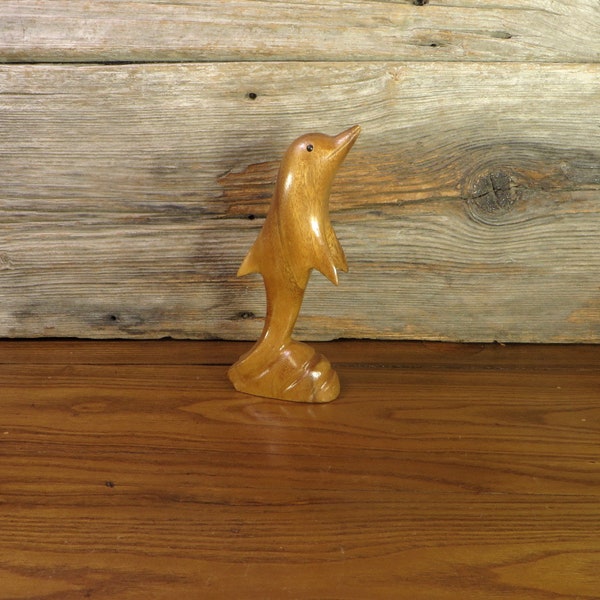
You are a GUI agent. You are given a task and a screenshot of the screen. Output one action in this format:
    pyautogui.click(x=<x>, y=<y>)
    Task: Click on the light brown statue
    This screenshot has width=600, height=600.
    Given the screenshot: What is the action you would take?
    pyautogui.click(x=286, y=302)